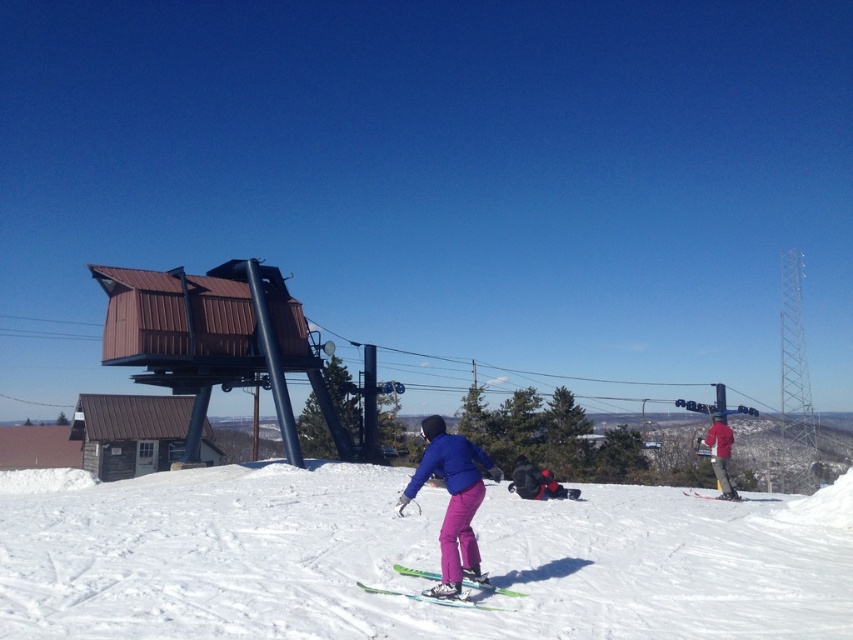
Does green plastic ski at center have a lesser width compared to red fabric jacket at right?

Correct, green plastic ski at center's width is less than red fabric jacket at right's.

Is point (370, 588) farther from camera compared to point (722, 442)?

No, it is in front of (722, 442).

This screenshot has width=853, height=640. What are the coordinates of `green plastic ski at center` in the screenshot? It's located at (450, 596).

Locate an element on the screen. The image size is (853, 640). red fabric jacket at right is located at coordinates (720, 454).

Describe the element at coordinates (720, 454) in the screenshot. Image resolution: width=853 pixels, height=640 pixels. I see `red fabric jacket at right` at that location.

The image size is (853, 640). In order to click on red fabric jacket at right in this screenshot , I will do `click(720, 454)`.

Looking at this image, between matte blue jacket at center and red fabric jacket at right, which one has less height?

Standing shorter between the two is matte blue jacket at center.

Does point (476, 564) come closer to viewer compared to point (714, 449)?

Yes, it is.

Is point (457, 568) behind point (714, 420)?

That is False.

Where is `matte blue jacket at center`? The image size is (853, 640). matte blue jacket at center is located at coordinates (x=451, y=500).